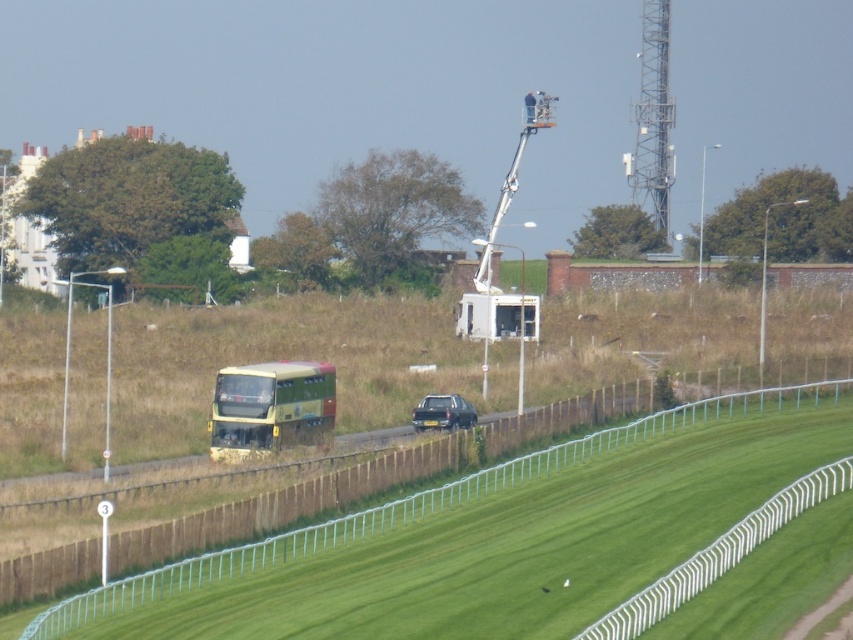
Can you confirm if yellow-green metallic bus at center-left is smaller than metallic tower at upper right?

Yes, yellow-green metallic bus at center-left is smaller than metallic tower at upper right.

From the picture: Is yellow-green metallic bus at center-left bigger than metallic tower at upper right?

No, yellow-green metallic bus at center-left is not bigger than metallic tower at upper right.

Describe the element at coordinates (270, 406) in the screenshot. I see `yellow-green metallic bus at center-left` at that location.

Locate an element on the screen. This screenshot has height=640, width=853. yellow-green metallic bus at center-left is located at coordinates (270, 406).

Is metallic tower at upper right taller than metallic silver car at center?

Correct, metallic tower at upper right is much taller as metallic silver car at center.

Which is more to the left, metallic tower at upper right or metallic silver car at center?

metallic silver car at center is more to the left.

Which is in front, point (641, 83) or point (463, 419)?

Point (463, 419)

You are a GUI agent. You are given a task and a screenshot of the screen. Output one action in this format:
    pyautogui.click(x=<x>, y=<y>)
    Task: Click on the metallic tower at upper right
    The width and height of the screenshot is (853, 640).
    Given the screenshot: What is the action you would take?
    pyautogui.click(x=653, y=120)

The image size is (853, 640). I want to click on yellow-green metallic bus at center-left, so click(x=270, y=406).

Is yellow-green metallic bus at center-left below metallic silver car at center?

Yes.

Between point (271, 413) and point (427, 403), which one is positioned in front?

Point (271, 413)

Image resolution: width=853 pixels, height=640 pixels. Identify the location of yellow-green metallic bus at center-left. (270, 406).